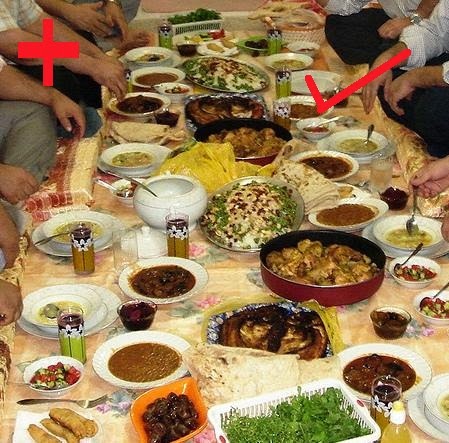
Locate an element on the screen. The height and width of the screenshot is (443, 449). bowl of bread is located at coordinates (301, 29).